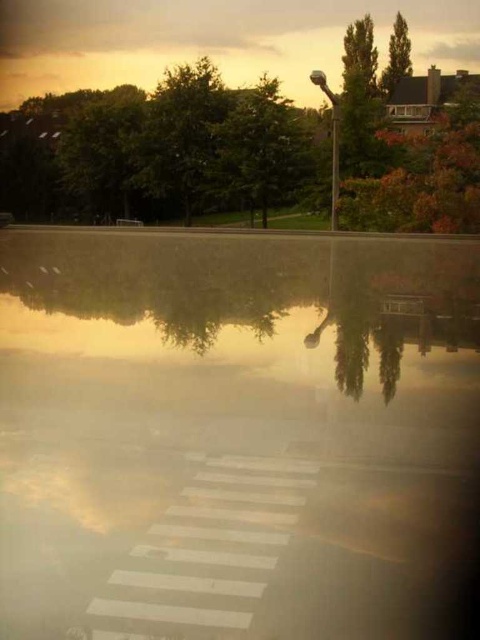
You are standing at the point marked by the coordinates point (236, 435) in the image. What is the material of the surface you are standing on?

The point (236, 435) indicates transparent glass water at center, so the surface is made of transparent glass water.